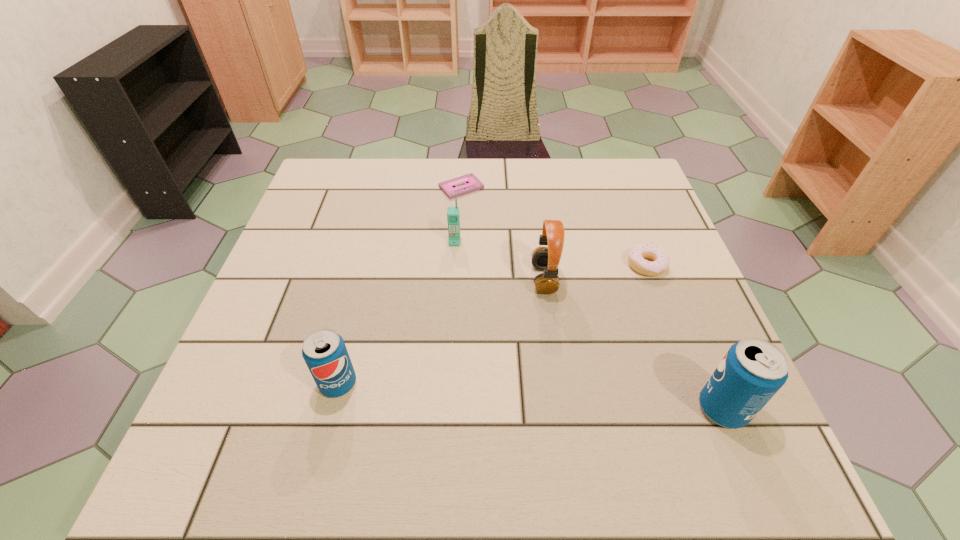
Locate an element on the screen. free space between the right soda can and the farthest object is located at coordinates (592, 298).

Locate an element on the screen. vacant space in between the shorter soda can and the headset is located at coordinates (441, 331).

The width and height of the screenshot is (960, 540). Identify the location of vacant area between the headset and the cellular telephone. (499, 260).

In order to click on free space between the headset and the leftmost object in this screenshot , I will do `click(441, 331)`.

Locate which object is the fifth closest to the fifth nearest object. Please provide its 2D coordinates. Your answer should be formatted as a tuple, i.e. [(x, y)], where the tuple contains the x and y coordinates of a point satisfying the conditions above.

[(753, 370)]

The height and width of the screenshot is (540, 960). I want to click on object that stands as the fourth closest to the headset, so click(x=753, y=370).

You are a GUI agent. You are given a task and a screenshot of the screen. Output one action in this format:
    pyautogui.click(x=<x>, y=<y>)
    Task: Click on the free spot that satisfies the following two spatial constraints: 1. on the ear cups of the third object from right to left; 2. on the back side of the taller soda can
    This screenshot has width=960, height=540.
    Given the screenshot: What is the action you would take?
    pyautogui.click(x=562, y=408)

Locate an element on the screen. This screenshot has width=960, height=540. vacant point that satisfies the following two spatial constraints: 1. on the keypad of the cellular telephone; 2. on the right side of the second shortest object is located at coordinates (453, 265).

Identify the location of free point that satisfies the following two spatial constraints: 1. on the back side of the shorter soda can; 2. on the left side of the farthest object. (388, 187).

At what (x,y) coordinates should I click in order to perform the action: click on free region that satisfies the following two spatial constraints: 1. on the ear cups of the right soda can; 2. on the left side of the headset. Please return your answer as a coordinate pair (x, y). Looking at the image, I should click on (562, 408).